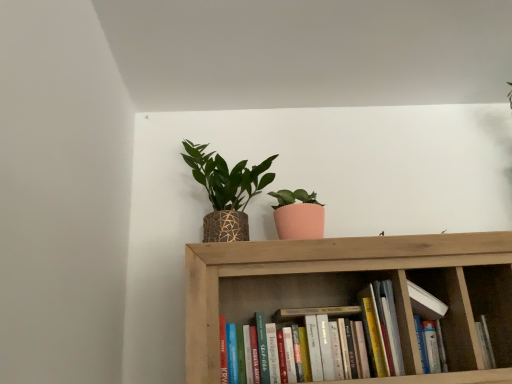
Question: Is white matte book at center, positioned as the first book in right-to-left order, not within hardcover books at center, placed as the 2th book when sorted from right to left?

Choices:
 (A) no
 (B) yes

Answer: (B)

Question: Considering the relative sizes of white matte book at center, positioned as the first book in right-to-left order, and hardcover books at center, placed as the 2th book when sorted from right to left, in the image provided, is white matte book at center, positioned as the first book in right-to-left order, shorter than hardcover books at center, placed as the 2th book when sorted from right to left,?

Choices:
 (A) no
 (B) yes

Answer: (B)

Question: Is white matte book at center, positioned as the first book in right-to-left order, bigger than hardcover books at center, placed as the 2th book when sorted from right to left?

Choices:
 (A) yes
 (B) no

Answer: (B)

Question: Is white matte book at center, which ranks as the 2th book in left-to-right order, not close to hardcover books at center, placed as the 2th book when sorted from right to left?

Choices:
 (A) no
 (B) yes

Answer: (A)

Question: From a real-world perspective, is white matte book at center, positioned as the first book in right-to-left order, on top of hardcover books at center, the 1th book in the left-to-right sequence?

Choices:
 (A) no
 (B) yes

Answer: (B)

Question: From a real-world perspective, is textured woven pot at upper center above or below wooden bookshelf at center?

Choices:
 (A) below
 (B) above

Answer: (B)

Question: Is textured woven pot at upper center inside the boundaries of wooden bookshelf at center, or outside?

Choices:
 (A) outside
 (B) inside

Answer: (A)

Question: In terms of height, does textured woven pot at upper center look taller or shorter compared to wooden bookshelf at center?

Choices:
 (A) short
 (B) tall

Answer: (B)

Question: Considering the positions of textured woven pot at upper center and wooden bookshelf at center in the image, is textured woven pot at upper center wider or thinner than wooden bookshelf at center?

Choices:
 (A) wide
 (B) thin

Answer: (B)

Question: Is hardcover books at center, placed as the 2th book when sorted from right to left, in front of or behind textured woven pot at upper center in the image?

Choices:
 (A) behind
 (B) front

Answer: (B)

Question: Looking at their shapes, would you say hardcover books at center, placed as the 2th book when sorted from right to left, is wider or thinner than textured woven pot at upper center?

Choices:
 (A) thin
 (B) wide

Answer: (A)

Question: In the image, is hardcover books at center, placed as the 2th book when sorted from right to left, on the left side or the right side of textured woven pot at upper center?

Choices:
 (A) left
 (B) right

Answer: (B)

Question: In terms of height, does hardcover books at center, placed as the 2th book when sorted from right to left, look taller or shorter compared to textured woven pot at upper center?

Choices:
 (A) tall
 (B) short

Answer: (B)

Question: Is white matte book at center, which ranks as the 2th book in left-to-right order, wider or thinner than textured woven pot at upper center?

Choices:
 (A) thin
 (B) wide

Answer: (A)

Question: From the image's perspective, is white matte book at center, positioned as the first book in right-to-left order, above or below textured woven pot at upper center?

Choices:
 (A) above
 (B) below

Answer: (B)